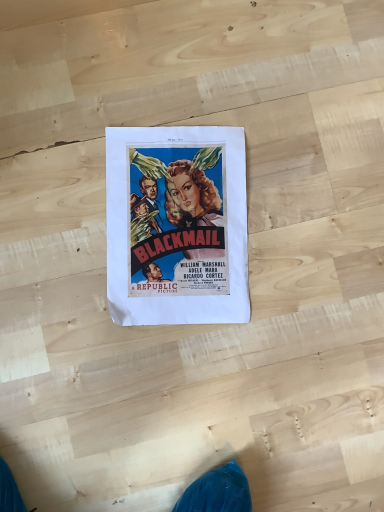
This screenshot has height=512, width=384. In order to click on vacant area on top of matte paper poster at center (from a real-world perspective) in this screenshot , I will do `click(180, 220)`.